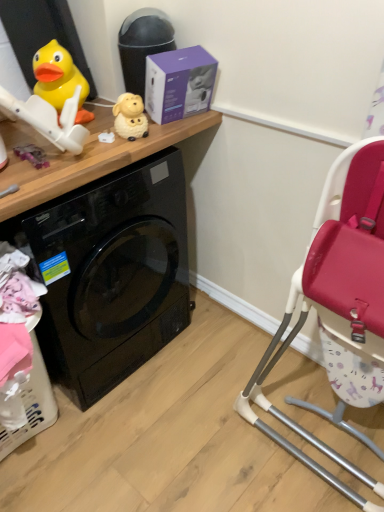
Where is `vacant space to the right of black glossy washing machine at left`? Image resolution: width=384 pixels, height=512 pixels. vacant space to the right of black glossy washing machine at left is located at coordinates (228, 371).